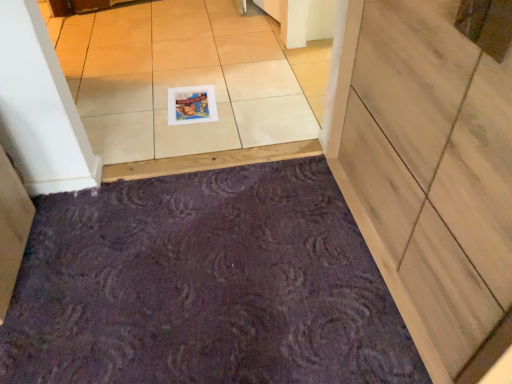
Identify the location of purple textured bath mat at lower center. (204, 285).

The height and width of the screenshot is (384, 512). Describe the element at coordinates (187, 78) in the screenshot. I see `white glossy tile at upper center` at that location.

Describe the element at coordinates (431, 172) in the screenshot. I see `wooden door at lower right` at that location.

This screenshot has height=384, width=512. What do you see at coordinates (191, 105) in the screenshot?
I see `matte plastic postcard at center` at bounding box center [191, 105].

Identify the location of purple textured bath mat at lower center. The height and width of the screenshot is (384, 512). (204, 285).

Is white glossy tile at upper center turned away from purple textured bath mat at lower center?

No, white glossy tile at upper center is not facing the opposite direction of purple textured bath mat at lower center.

From the image's perspective, relative to purple textured bath mat at lower center, is white glossy tile at upper center above or below?

white glossy tile at upper center is situated higher than purple textured bath mat at lower center in the image.

Between white glossy tile at upper center and purple textured bath mat at lower center, which one has more height?

Standing taller between the two is purple textured bath mat at lower center.

Is white glossy tile at upper center completely or partially outside of purple textured bath mat at lower center?

Yes, white glossy tile at upper center is not within purple textured bath mat at lower center.

Is white glossy tile at upper center positioned with its back to matte plastic postcard at center?

white glossy tile at upper center is not turned away from matte plastic postcard at center.

Considering the points (207, 33) and (192, 95), which point is in front, point (207, 33) or point (192, 95)?

The point (192, 95) is in front.

Is white glossy tile at upper center in contact with matte plastic postcard at center?

No, white glossy tile at upper center is not next to matte plastic postcard at center.

Is white glossy tile at upper center outside of matte plastic postcard at center?

Yes, white glossy tile at upper center is outside of matte plastic postcard at center.

Considering the relative positions of purple textured bath mat at lower center and white glossy tile at upper center in the image provided, is purple textured bath mat at lower center to the right of white glossy tile at upper center from the viewer's perspective?

Correct, you'll find purple textured bath mat at lower center to the right of white glossy tile at upper center.

What's the angular difference between purple textured bath mat at lower center and white glossy tile at upper center's facing directions?

180 degrees.

At what (x,y) coordinates should I click in order to perform the action: click on tile above the purple textured bath mat at lower center (from a real-world perspective). Please return your answer as a coordinate pair (x, y). This screenshot has height=384, width=512. Looking at the image, I should click on (187, 78).

Which is correct: purple textured bath mat at lower center is inside white glossy tile at upper center, or outside of it?

purple textured bath mat at lower center is spatially situated outside white glossy tile at upper center.

Locate an element on the screen. This screenshot has height=384, width=512. bath mat below the matte plastic postcard at center (from a real-world perspective) is located at coordinates (204, 285).

Is purple textured bath mat at lower center at the back of matte plastic postcard at center?

No, matte plastic postcard at center's orientation is not away from purple textured bath mat at lower center.

Is matte plastic postcard at center next to purple textured bath mat at lower center?

matte plastic postcard at center and purple textured bath mat at lower center are clearly separated.

Is matte plastic postcard at center positioned before purple textured bath mat at lower center?

That is False.

From the image's perspective, which object appears higher, matte plastic postcard at center or wooden door at lower right?

matte plastic postcard at center, from the image's perspective.

Considering the sizes of matte plastic postcard at center and wooden door at lower right in the image, is matte plastic postcard at center wider or thinner than wooden door at lower right?

Considering their sizes, matte plastic postcard at center looks slimmer than wooden door at lower right.

Is matte plastic postcard at center spatially inside wooden door at lower right, or outside of it?

matte plastic postcard at center is not enclosed by wooden door at lower right.

Is matte plastic postcard at center placed right next to wooden door at lower right?

No.

In the scene shown: From a real-world perspective, is purple textured bath mat at lower center physically above wooden door at lower right?

No.

Can you confirm if purple textured bath mat at lower center is wider than wooden door at lower right?

Correct, the width of purple textured bath mat at lower center exceeds that of wooden door at lower right.

Does purple textured bath mat at lower center have a smaller size compared to wooden door at lower right?

Correct, purple textured bath mat at lower center occupies less space than wooden door at lower right.

How far apart are purple textured bath mat at lower center and wooden door at lower right?

purple textured bath mat at lower center and wooden door at lower right are 18.69 inches apart.

Consider the image. From the image's perspective, is purple textured bath mat at lower center beneath matte plastic postcard at center?

Correct, purple textured bath mat at lower center appears lower than matte plastic postcard at center in the image.

The height and width of the screenshot is (384, 512). What are the coordinates of `bath mat that is on the right side of matte plastic postcard at center` in the screenshot? It's located at (204, 285).

Is purple textured bath mat at lower center oriented away from matte plastic postcard at center?

That's not correct — purple textured bath mat at lower center is not looking away from matte plastic postcard at center.

Considering the positions of objects purple textured bath mat at lower center and matte plastic postcard at center in the image provided, who is more to the left, purple textured bath mat at lower center or matte plastic postcard at center?

matte plastic postcard at center.

Where is `tile that appears behind the purple textured bath mat at lower center`? This screenshot has width=512, height=384. tile that appears behind the purple textured bath mat at lower center is located at coordinates (187, 78).

Locate an element on the screen. This screenshot has height=384, width=512. tile above the matte plastic postcard at center (from a real-world perspective) is located at coordinates (187, 78).

Looking at this image, when comparing their distances from matte plastic postcard at center, does white glossy tile at upper center or wooden door at lower right seem closer?

white glossy tile at upper center is positioned closer to the anchor matte plastic postcard at center.

Looking at the image, which one is located further to matte plastic postcard at center, white glossy tile at upper center or purple textured bath mat at lower center?

The object further to matte plastic postcard at center is purple textured bath mat at lower center.

Which object lies nearer to the anchor point purple textured bath mat at lower center, white glossy tile at upper center or wooden door at lower right?

wooden door at lower right lies closer to purple textured bath mat at lower center than the other object.

When comparing their distances from matte plastic postcard at center, does purple textured bath mat at lower center or wooden door at lower right seem further?

Based on the image, wooden door at lower right appears to be further to matte plastic postcard at center.

In the scene shown: Which object lies nearer to the anchor point purple textured bath mat at lower center, matte plastic postcard at center or wooden door at lower right?

The object closer to purple textured bath mat at lower center is wooden door at lower right.

Based on their spatial positions, is purple textured bath mat at lower center or white glossy tile at upper center further from wooden door at lower right?

white glossy tile at upper center.

Looking at this image, which object lies nearer to the anchor point wooden door at lower right, matte plastic postcard at center or purple textured bath mat at lower center?

purple textured bath mat at lower center is positioned closer to the anchor wooden door at lower right.

Considering their positions, is matte plastic postcard at center positioned further to white glossy tile at upper center than purple textured bath mat at lower center?

Based on the image, purple textured bath mat at lower center appears to be further to white glossy tile at upper center.

Where is `bath mat located between wooden door at lower right and matte plastic postcard at center in the depth direction`? The width and height of the screenshot is (512, 384). bath mat located between wooden door at lower right and matte plastic postcard at center in the depth direction is located at coordinates (204, 285).

Where is `postcard between white glossy tile at upper center and purple textured bath mat at lower center from top to bottom`? postcard between white glossy tile at upper center and purple textured bath mat at lower center from top to bottom is located at coordinates (191, 105).

What are the coordinates of `tile positioned between wooden door at lower right and matte plastic postcard at center from near to far` in the screenshot? It's located at (187, 78).

At what (x,y) coordinates should I click in order to perform the action: click on bath mat located between wooden door at lower right and white glossy tile at upper center in the depth direction. Please return your answer as a coordinate pair (x, y). The height and width of the screenshot is (384, 512). Looking at the image, I should click on (204, 285).